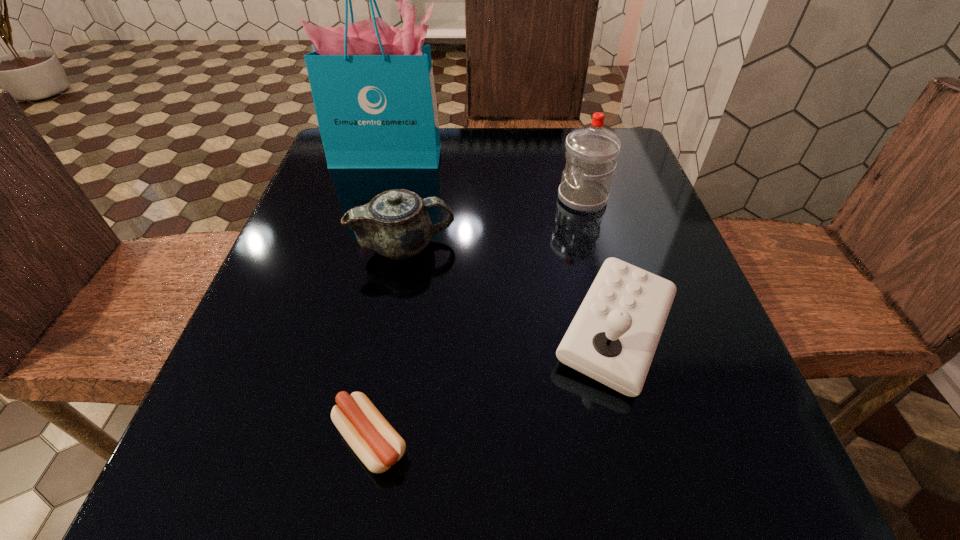
You are a GUI agent. You are given a task and a screenshot of the screen. Output one action in this format:
    pyautogui.click(x=<x>, y=<y>)
    Task: Click on the free spot that satisfies the following two spatial constraints: 1. on the handle side of the water bottle; 2. on the front side of the nearest object
    
    Given the screenshot: What is the action you would take?
    pyautogui.click(x=648, y=440)

This screenshot has width=960, height=540. I want to click on free spot that satisfies the following two spatial constraints: 1. from the spout of the third farthest object; 2. on the back side of the joystick, so click(390, 331).

Locate an element on the screen. This screenshot has width=960, height=540. free point that satisfies the following two spatial constraints: 1. on the back side of the fourth farthest object; 2. on the right side of the shortest object is located at coordinates (391, 331).